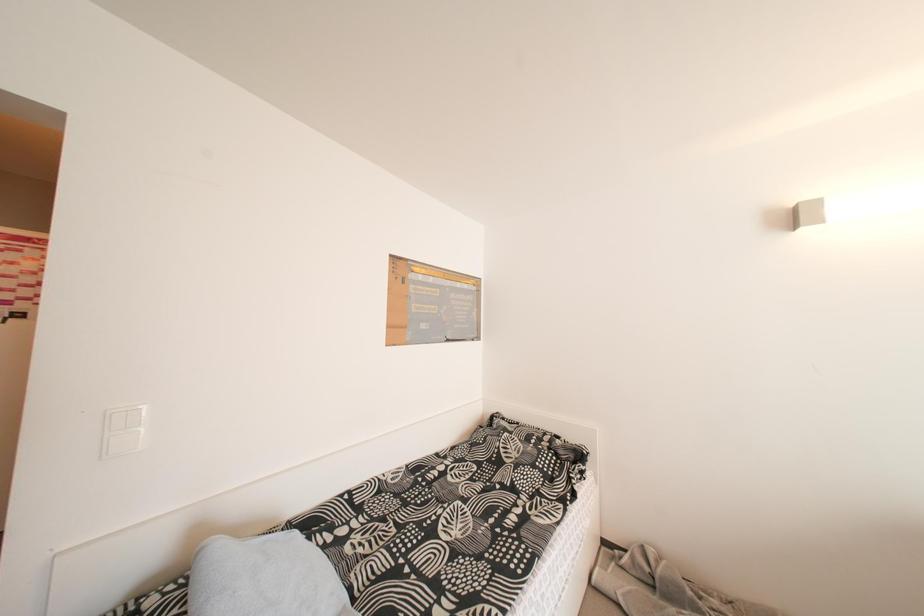
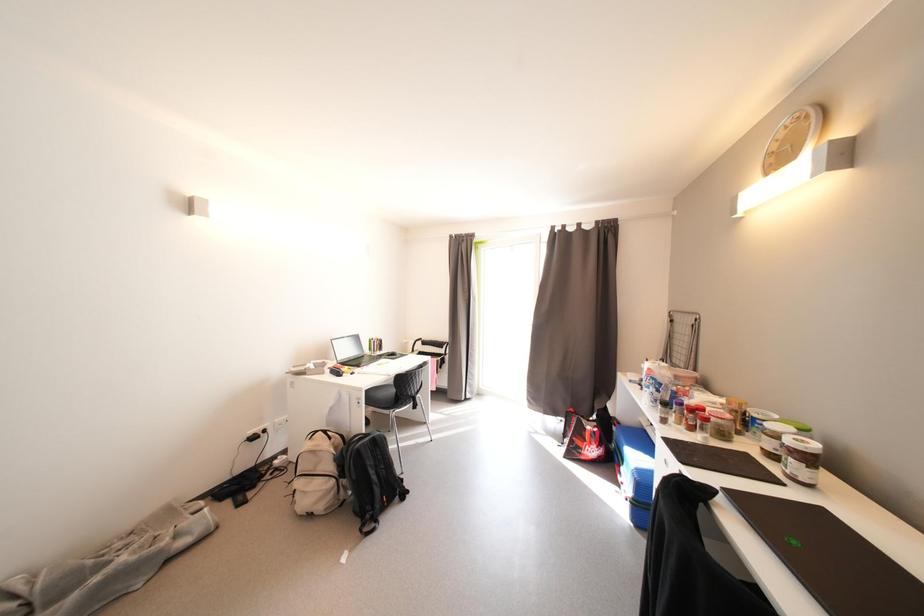
Question: The images are taken continuously from a first-person perspective. In which direction is your viewpoint rotating?

Choices:
 (A) Left
 (B) Right
 (C) Up
 (D) Down

Answer: (B)